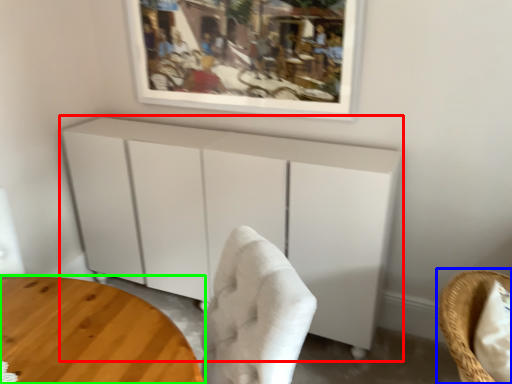
Question: Which object is positioned farthest from cabinetry (highlighted by a red box)? Select from chair (highlighted by a blue box) and table (highlighted by a green box).

Choices:
 (A) chair
 (B) table

Answer: (A)